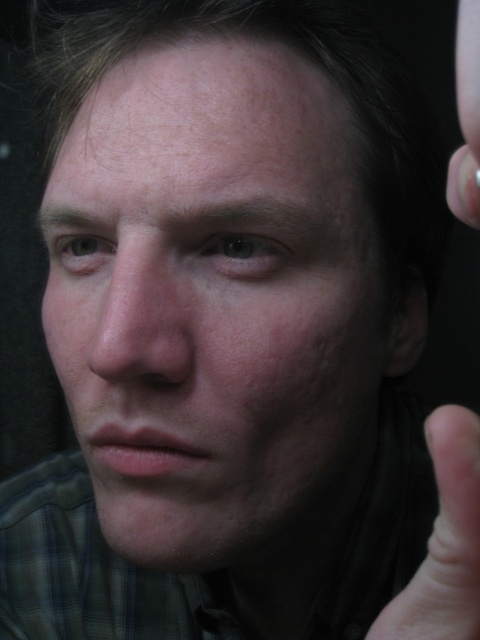
You are a photographer adjusting the lighting for a portrait. You notice the smooth skin face at center and the smooth skin thumb at lower right in the frame. Which object is more to the left?

The smooth skin face at center is positioned on the left side of the smooth skin thumb at lower right, so the smooth skin face at center is more to the left.

Consider the image. You are a photographer adjusting the lighting for a portrait. You notice the smooth skin face at center and the smooth skin thumb at lower right in the frame. Which object is positioned higher in the image?

The smooth skin face at center is positioned higher than the smooth skin thumb at lower right.

Based on the scene description, can you determine if the smooth skin face at center is wider than the smooth skin thumb at lower right?

The smooth skin face at center might be wider than smooth skin thumb at lower right according to the objects description.